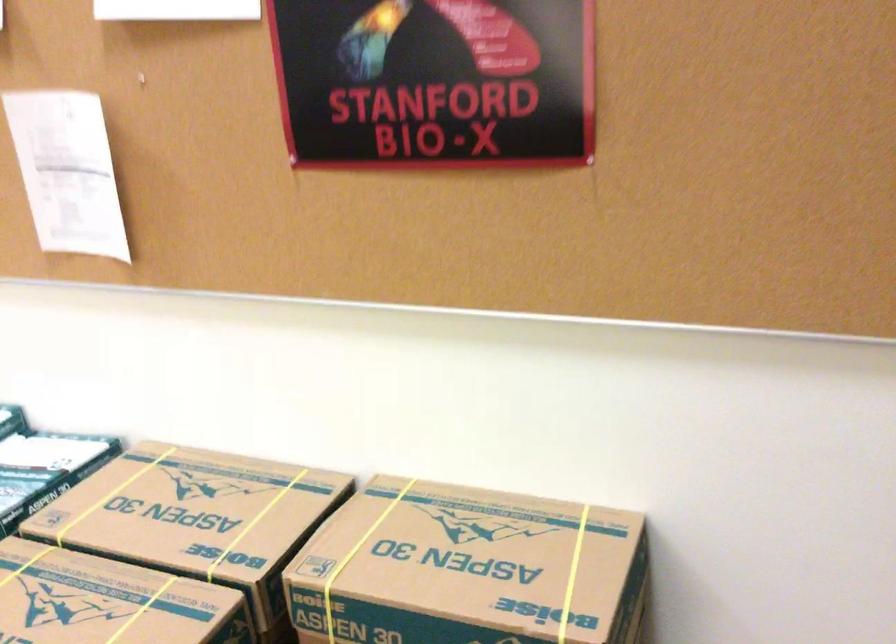
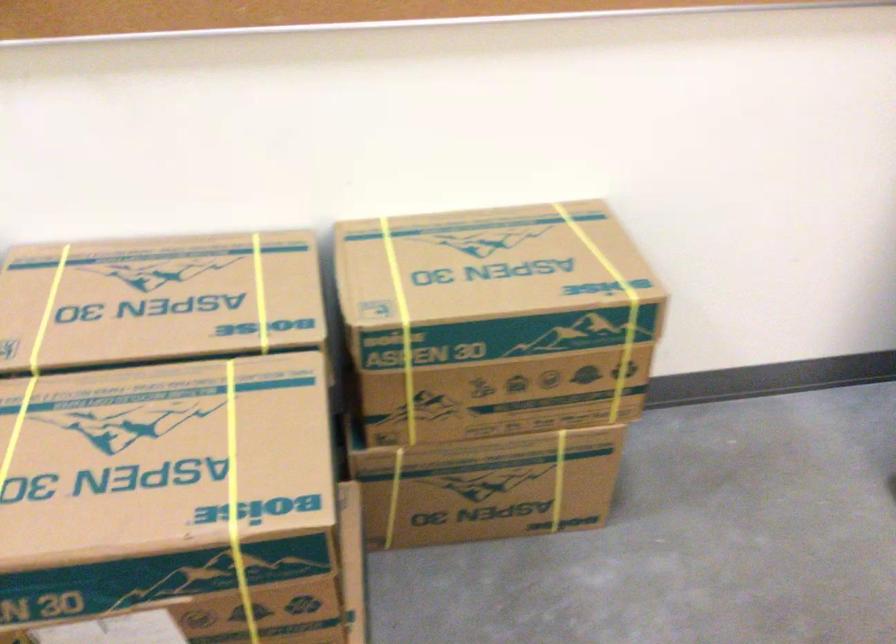
Locate, in the second image, the point that corresponds to [251,522] in the first image.

(260, 292)